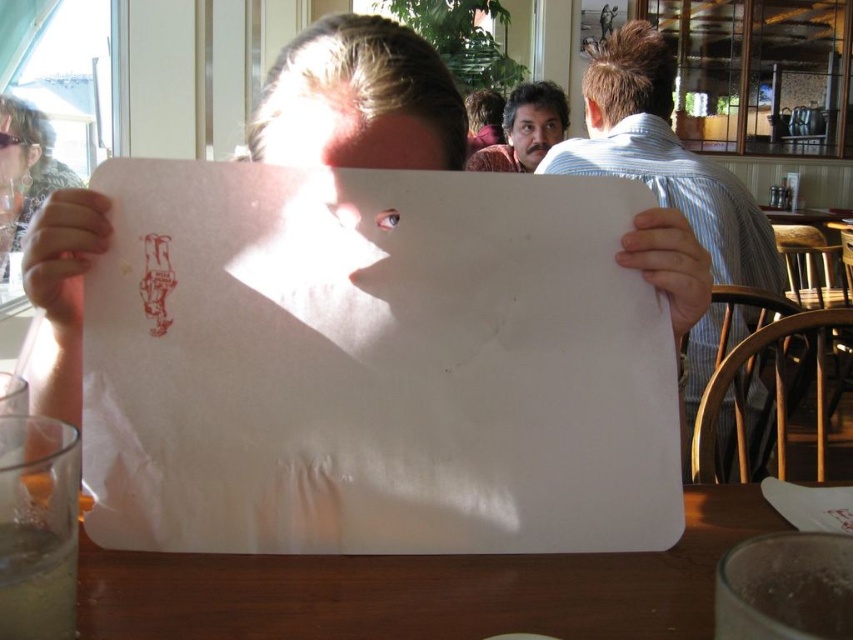
You are a photographer trying to capture a clear shot of the person in the center. The white paper at center and the smooth skin face at upper center are both in your frame. Which object is closer to your camera lens?

The white paper at center is closer to the viewer than the smooth skin face at upper center, so the white paper at center is closer to the camera lens.

You are standing in the dining area and want to take a photo of the two points mentioned. Which point, point (x=235, y=461) or point (x=515, y=140), will appear larger in your photo?

Point (x=235, y=461) will appear larger in the photo because it is closer to the camera than point (x=515, y=140).